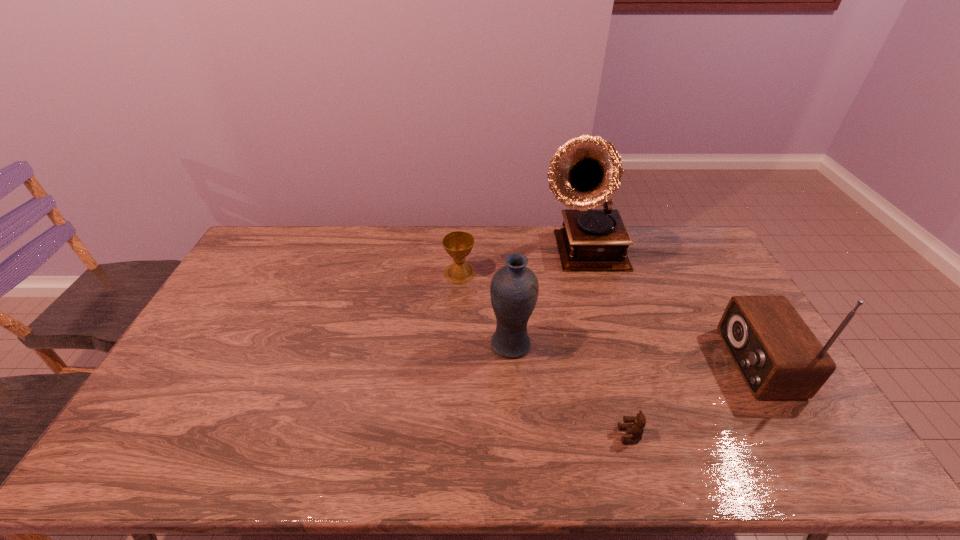
Where is `blank space located on the front-facing side of the rightmost object`? blank space located on the front-facing side of the rightmost object is located at coordinates (681, 362).

Where is `vacant space located 0.100m on the left of the second object from left to right`? This screenshot has width=960, height=540. vacant space located 0.100m on the left of the second object from left to right is located at coordinates tap(456, 345).

Find the location of a particular element. Image resolution: width=960 pixels, height=540 pixels. free space located on the right of the leftmost object is located at coordinates (557, 273).

The height and width of the screenshot is (540, 960). I want to click on vacant space located 0.190m on the face of the shortest object, so click(543, 435).

Locate an element on the screen. free space located 0.250m on the face of the shortest object is located at coordinates (520, 435).

At what (x,y) coordinates should I click in order to perform the action: click on free spot located 0.050m on the face of the shortest object. Please return your answer as a coordinate pair (x, y). Looking at the image, I should click on (599, 435).

Find the location of a particular element. Image resolution: width=960 pixels, height=540 pixels. record player located at the far edge is located at coordinates [x=585, y=172].

Where is `chalice present at the far edge`? The width and height of the screenshot is (960, 540). chalice present at the far edge is located at coordinates click(458, 244).

In order to click on object situated at the near edge in this screenshot , I will do `click(636, 429)`.

This screenshot has width=960, height=540. I want to click on object situated at the right edge, so click(x=779, y=357).